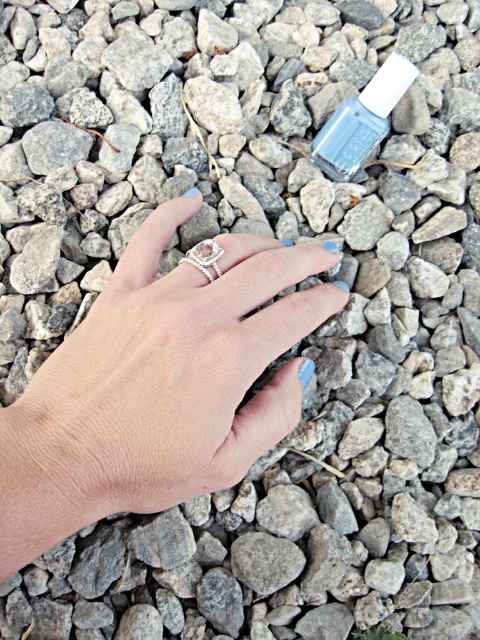
You are an artist trying to paint this scene. You need to know the spatial relationship between the matte silver ring at center and the matte gray nail polish at upper center. Which one is located to the left?

The matte silver ring at center is positioned on the left side of matte gray nail polish at upper center.